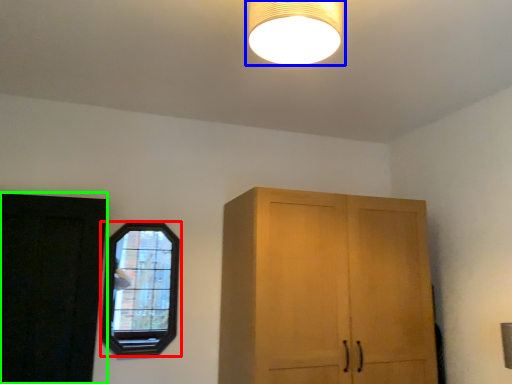
Question: Which is nearer to the window (highlighted by a red box)? lamp (highlighted by a blue box) or door (highlighted by a green box).

Choices:
 (A) lamp
 (B) door

Answer: (B)